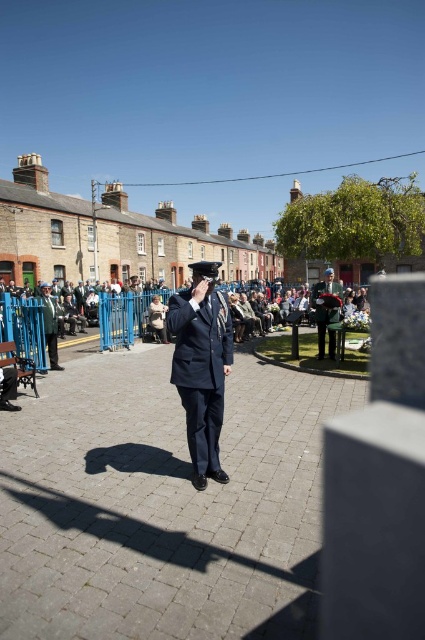
You are observing a group of people in a public square. You notice two uniforms in the center of the image, a green uniform at center and a matte black uniform at center. Which one is taller?

The green uniform at center is taller than the matte black uniform at center.